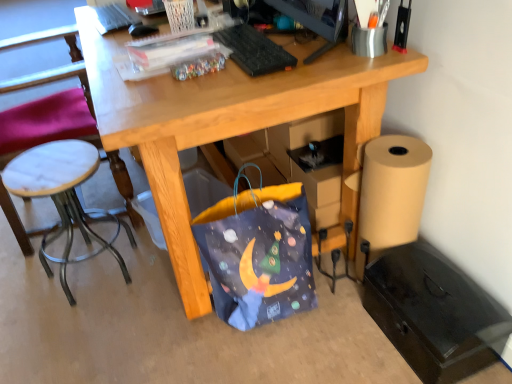
Locate an element on the screen. The width and height of the screenshot is (512, 384). white marble stool at left is located at coordinates (64, 199).

What do you see at coordinates (47, 101) in the screenshot? I see `white marble stool at left` at bounding box center [47, 101].

Image resolution: width=512 pixels, height=384 pixels. In order to click on black matte file cabinet at lower right in this screenshot , I will do `click(432, 313)`.

This screenshot has width=512, height=384. Identify the location of white marble stool at left. (64, 199).

From a real-world perspective, which object rests below the other?

white marble stool at left.

Are black plastic keyboard at upper center and white marble stool at left making contact?

No, black plastic keyboard at upper center is not touching white marble stool at left.

Can you confirm if black plastic keyboard at upper center is positioned to the right of white marble stool at left?

Indeed, black plastic keyboard at upper center is positioned on the right side of white marble stool at left.

Is black matte file cabinet at lower right aimed at white marble stool at left?

No, black matte file cabinet at lower right is not turned towards white marble stool at left.

Considering the positions of objects black matte file cabinet at lower right and white marble stool at left in the image provided, who is behind, black matte file cabinet at lower right or white marble stool at left?

white marble stool at left is further from the camera.

Considering the relative positions of black matte file cabinet at lower right and white marble stool at left in the image provided, is black matte file cabinet at lower right to the left of white marble stool at left from the viewer's perspective?

Incorrect, black matte file cabinet at lower right is not on the left side of white marble stool at left.

Looking at this image, which object is wider, black matte file cabinet at lower right or white marble stool at left?

Wider between the two is white marble stool at left.

Consider the image. Considering the sizes of objects white marble stool at left and black plastic keyboard at upper center in the image provided, who is smaller, white marble stool at left or black plastic keyboard at upper center?

black plastic keyboard at upper center is smaller.

Is point (50, 178) closer or farther from the camera than point (263, 49)?

Point (50, 178) appears to be farther away from the viewer than point (263, 49).

What's the angular difference between white marble stool at left and black plastic keyboard at upper center's facing directions?

The angular difference between white marble stool at left and black plastic keyboard at upper center is 178 degrees.

From the image's perspective, which one is positioned higher, white marble stool at left or black plastic keyboard at upper center?

black plastic keyboard at upper center is shown above in the image.

Are black matte file cabinet at lower right and black plastic monitor at upper center far apart?

Actually, black matte file cabinet at lower right and black plastic monitor at upper center are a little close together.

In the image, is black matte file cabinet at lower right positioned in front of or behind black plastic monitor at upper center?

Clearly, black matte file cabinet at lower right is behind black plastic monitor at upper center.

Could you tell me if black matte file cabinet at lower right is facing black plastic monitor at upper center?

No.

The width and height of the screenshot is (512, 384). I want to click on file cabinet located behind the black plastic monitor at upper center, so click(x=432, y=313).

Which of these two, white marble stool at left or white marble stool at left, stands taller?

white marble stool at left.

From a real-world perspective, is white marble stool at left positioned over white marble stool at left based on gravity?

Yes, from a real-world perspective, white marble stool at left is above white marble stool at left.

In the scene shown: Considering the relative positions of white marble stool at left and white marble stool at left in the image provided, is white marble stool at left to the left or to the right of white marble stool at left?

From the image, it's evident that white marble stool at left is to the left of white marble stool at left.

Which is further, (59, 28) or (85, 238)?

Point (59, 28)

In the scene shown: Which is nearer, (67, 159) or (65, 95)?

Point (67, 159) appears to be closer to the viewer than point (65, 95).

How different are the orientations of white marble stool at left and white marble stool at left in degrees?

white marble stool at left and white marble stool at left are facing 4.19 degrees away from each other.

From the image's perspective, between white marble stool at left and white marble stool at left, which one is located above?

white marble stool at left appears higher in the image.

From a real-world perspective, who is located lower, white marble stool at left or white marble stool at left?

white marble stool at left, from a real-world perspective.

Between black plastic keyboard at upper center and black plastic monitor at upper center, which one has more height?

Standing taller between the two is black plastic monitor at upper center.

Is black plastic keyboard at upper center situated inside black plastic monitor at upper center or outside?

black plastic keyboard at upper center is not inside black plastic monitor at upper center, it's outside.

Which is farther from the camera, (283, 69) or (321, 27)?

The point (283, 69) is more distant.

In order to click on keyboard above the white marble stool at left (from a real-world perspective) in this screenshot , I will do `click(254, 50)`.

This screenshot has width=512, height=384. In order to click on file cabinet in front of the white marble stool at left in this screenshot , I will do `click(432, 313)`.

When comparing their distances from black plastic monitor at upper center, does white marble stool at left or black matte file cabinet at lower right seem closer?

black matte file cabinet at lower right lies closer to black plastic monitor at upper center than the other object.

From the image, which object appears to be nearer to white marble stool at left, black plastic monitor at upper center or black matte file cabinet at lower right?

The object closer to white marble stool at left is black matte file cabinet at lower right.

Estimate the real-world distances between objects in this image. Which object is further from white marble stool at left, white marble stool at left or black plastic keyboard at upper center?

Based on the image, black plastic keyboard at upper center appears to be further to white marble stool at left.

Considering their positions, is black plastic keyboard at upper center positioned closer to blue fabric bag at lower center than white marble stool at left?

Based on the image, black plastic keyboard at upper center appears to be nearer to blue fabric bag at lower center.

Based on their spatial positions, is blue fabric bag at lower center or white marble stool at left closer to black plastic monitor at upper center?

blue fabric bag at lower center.

Based on their spatial positions, is black plastic monitor at upper center or white marble stool at left further from black plastic keyboard at upper center?

white marble stool at left is further to black plastic keyboard at upper center.

Which object lies nearer to the anchor point white marble stool at left, black plastic keyboard at upper center or blue fabric bag at lower center?

Among the two, blue fabric bag at lower center is located nearer to white marble stool at left.

From the image, which object appears to be nearer to black matte file cabinet at lower right, black plastic keyboard at upper center or blue fabric bag at lower center?

blue fabric bag at lower center lies closer to black matte file cabinet at lower right than the other object.

The image size is (512, 384). In order to click on keyboard located between white marble stool at left and black plastic monitor at upper center in the left-right direction in this screenshot , I will do `click(254, 50)`.

In order to click on keyboard between black plastic monitor at upper center and blue fabric bag at lower center from top to bottom in this screenshot , I will do `click(254, 50)`.

What are the coordinates of `bag between black plastic keyboard at upper center and black matte file cabinet at lower right in the up-down direction` in the screenshot? It's located at (258, 253).

The height and width of the screenshot is (384, 512). In order to click on stool between white marble stool at left and black matte file cabinet at lower right in the horizontal direction in this screenshot , I will do `click(64, 199)`.